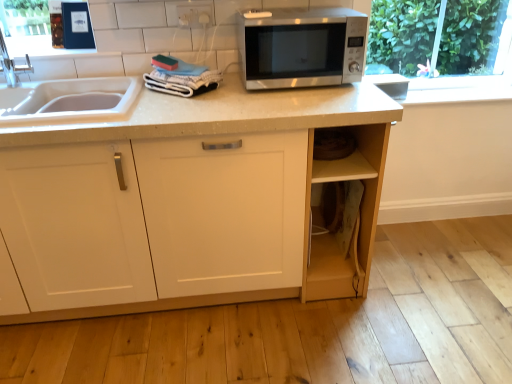
Question: Does satin silver microwave at center have a greater width compared to blue matte book at upper left?

Choices:
 (A) yes
 (B) no

Answer: (A)

Question: Does satin silver microwave at center have a smaller size compared to blue matte book at upper left?

Choices:
 (A) no
 (B) yes

Answer: (A)

Question: Is satin silver microwave at center not within blue matte book at upper left?

Choices:
 (A) no
 (B) yes

Answer: (B)

Question: Is satin silver microwave at center taller than blue matte book at upper left?

Choices:
 (A) yes
 (B) no

Answer: (A)

Question: Is satin silver microwave at center further to the viewer compared to blue matte book at upper left?

Choices:
 (A) no
 (B) yes

Answer: (A)

Question: Can you confirm if satin silver microwave at center is bigger than blue matte book at upper left?

Choices:
 (A) yes
 (B) no

Answer: (A)

Question: Is blue matte book at upper left outside of white plastic electric outlet at upper center?

Choices:
 (A) yes
 (B) no

Answer: (A)

Question: Does blue matte book at upper left have a smaller size compared to white plastic electric outlet at upper center?

Choices:
 (A) yes
 (B) no

Answer: (B)

Question: Does blue matte book at upper left have a lesser width compared to white plastic electric outlet at upper center?

Choices:
 (A) yes
 (B) no

Answer: (B)

Question: Is blue matte book at upper left far away from white plastic electric outlet at upper center?

Choices:
 (A) no
 (B) yes

Answer: (A)

Question: Does blue matte book at upper left lie in front of white plastic electric outlet at upper center?

Choices:
 (A) yes
 (B) no

Answer: (B)

Question: Is blue matte book at upper left at the left side of white plastic electric outlet at upper center?

Choices:
 (A) no
 (B) yes

Answer: (B)

Question: Is white plastic electric outlet at upper center wider than matte white cabinet at center?

Choices:
 (A) no
 (B) yes

Answer: (A)